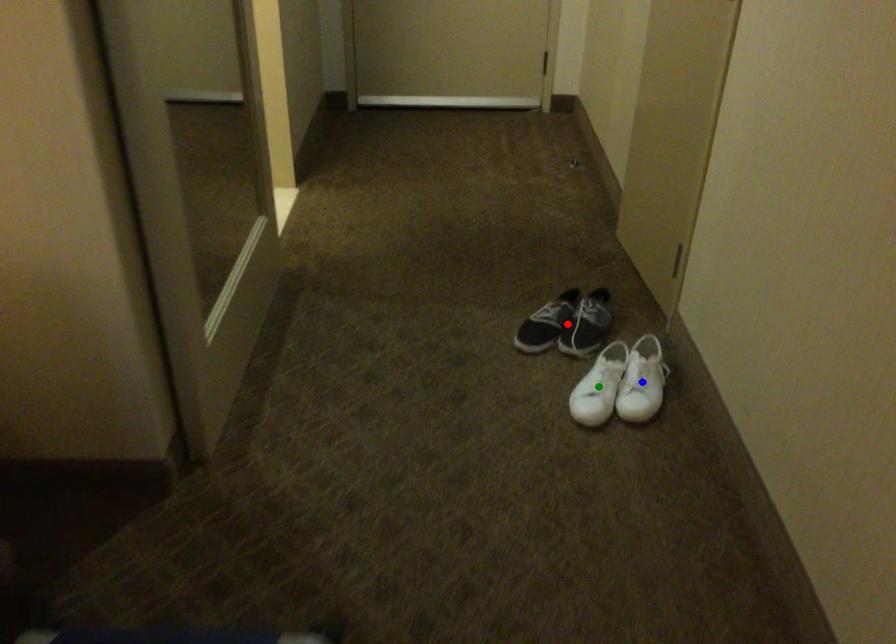
Order these from nearest to farthest:
1. green point
2. red point
3. blue point

1. green point
2. blue point
3. red point